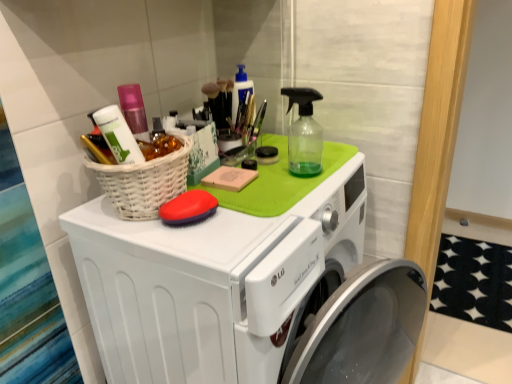
The height and width of the screenshot is (384, 512). Identify the location of free region on the left part of red rubber brush at center. (116, 222).